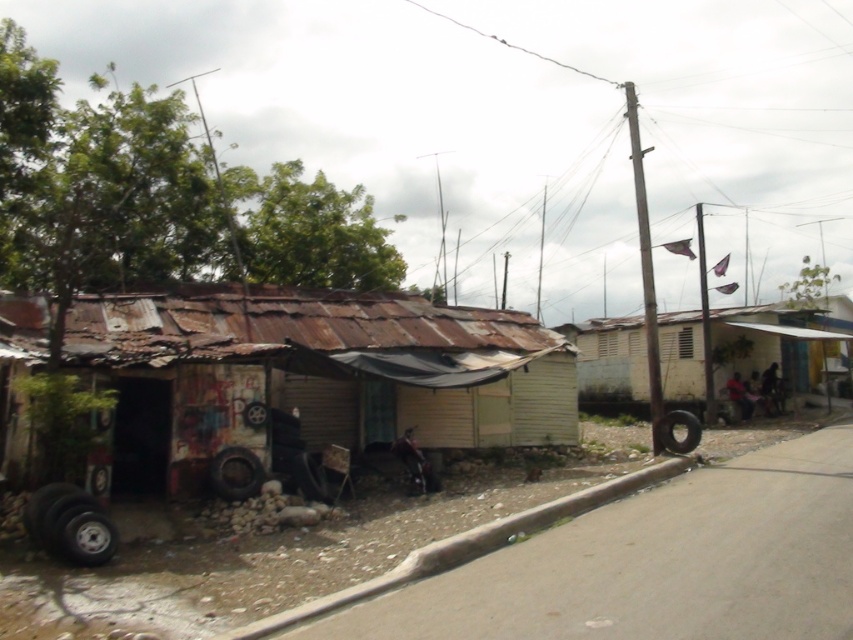
Question: Which point is farther to the camera?

Choices:
 (A) (672, 461)
 (B) (747, 352)

Answer: (B)

Question: Estimate the real-world distances between objects in this image. Which object is closer to the white corrugated metal hut at center-right?

Choices:
 (A) rusty tin hut at left
 (B) smooth concrete curb at lower center

Answer: (A)

Question: Estimate the real-world distances between objects in this image. Which object is farther from the rusty tin hut at left?

Choices:
 (A) white corrugated metal hut at center-right
 (B) smooth concrete curb at lower center

Answer: (A)

Question: Observing the image, what is the correct spatial positioning of rusty tin hut at left in reference to white corrugated metal hut at center-right?

Choices:
 (A) left
 (B) right

Answer: (A)

Question: Does white corrugated metal hut at center-right come behind smooth concrete curb at lower center?

Choices:
 (A) yes
 (B) no

Answer: (A)

Question: Does white corrugated metal hut at center-right appear on the left side of smooth concrete curb at lower center?

Choices:
 (A) no
 (B) yes

Answer: (A)